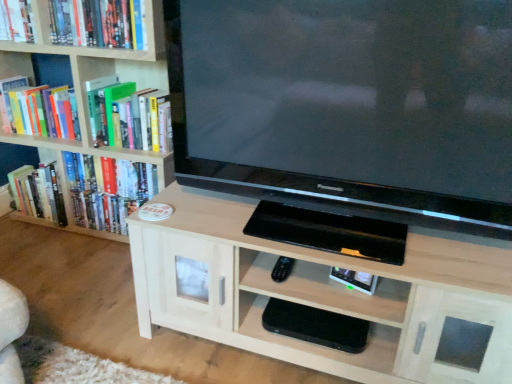
Question: In the image, is wooden bookcase at left positioned in front of or behind hardcover book at upper left, which is the fourth book from bottom to top?

Choices:
 (A) front
 (B) behind

Answer: (A)

Question: Is point pyautogui.click(x=105, y=54) closer or farther from the camera than point pyautogui.click(x=90, y=19)?

Choices:
 (A) closer
 (B) farther

Answer: (B)

Question: Which is nearer to the hardcover book at upper left, which ranks as the third book in bottom-to-top order?

Choices:
 (A) hardcover book at upper left, which is the fourth book from bottom to top
 (B) hardcover book at upper left, placed as the fifth book when sorted from bottom to top
 (C) wooden bookcase at left
 (D) black glossy television at center
 (E) green matte book at upper left, the fourth book positioned from the top

Answer: (C)

Question: Which of these objects is positioned closest to the light wood cabinet at center, positioned as the 2th shelf in bottom-to-top order?

Choices:
 (A) hardcover book at upper left, acting as the 1th book starting from the top
 (B) green matte book at upper left, the fourth book positioned from the top
 (C) black glossy television at center
 (D) hardcover book at left, which appears as the 1th book when ordered from the bottom
 (E) black plastic shelf at lower center, which is the 2th shelf in top-to-bottom order

Answer: (E)